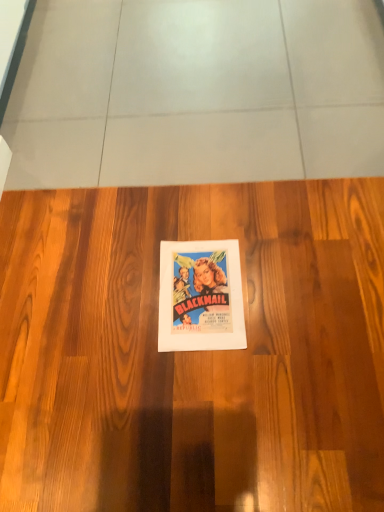
Locate an element on the screen. The height and width of the screenshot is (512, 384). free spot behind vibrant paper poster at center is located at coordinates (191, 212).